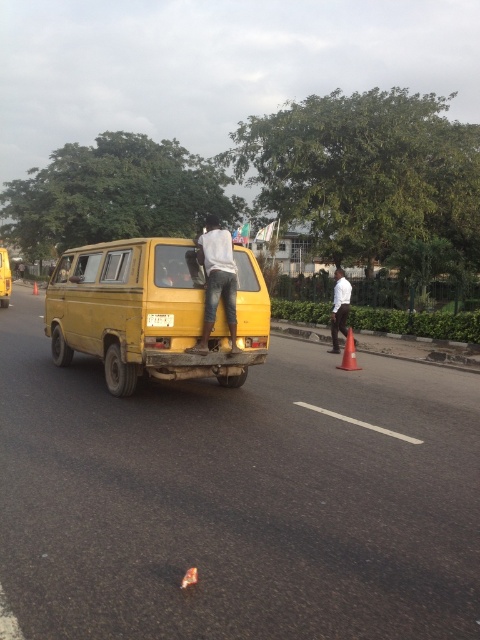
Who is higher up, white smooth shirt at right or yellow matte license plate at rear?

white smooth shirt at right

Is white smooth shirt at right smaller than yellow matte license plate at rear?

No.

At what (x,y) coordinates should I click in order to perform the action: click on white smooth shirt at right. Please return your answer as a coordinate pair (x, y). The image size is (480, 640). Looking at the image, I should click on (339, 307).

Does light gray jeans at rear have a larger size compared to orange matte traffic cone at center?

Yes.

Between light gray jeans at rear and orange matte traffic cone at center, which one is positioned higher?

light gray jeans at rear

You are a GUI agent. You are given a task and a screenshot of the screen. Output one action in this format:
    pyautogui.click(x=<x>, y=<y>)
    Task: Click on the light gray jeans at rear
    This screenshot has height=640, width=480.
    Given the screenshot: What is the action you would take?
    pyautogui.click(x=216, y=282)

The height and width of the screenshot is (640, 480). Find the location of `light gray jeans at rear`. light gray jeans at rear is located at coordinates (216, 282).

Between point (49, 285) and point (9, 266), which one is positioned in front?

Point (49, 285) is more forward.

Between yellow matte van at center and yellow matte taxi at center, which one has less height?

Standing shorter between the two is yellow matte taxi at center.

The height and width of the screenshot is (640, 480). Find the location of `yellow matte van at center`. yellow matte van at center is located at coordinates point(152,312).